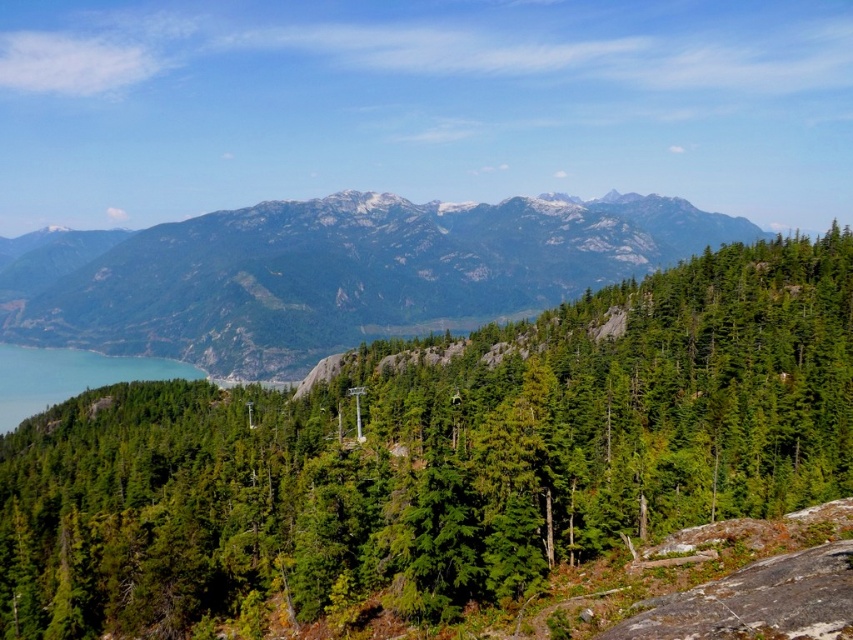
Measure the distance between green matte tree at center and camera.

green matte tree at center is 175.66 feet away from camera.

Is green matte tree at center above green rocky mountain at center?

Incorrect, green matte tree at center is not positioned above green rocky mountain at center.

Which is in front, point (682, 339) or point (173, 269)?

Positioned in front is point (682, 339).

You are a GUI agent. You are given a task and a screenshot of the screen. Output one action in this format:
    pyautogui.click(x=<x>, y=<y>)
    Task: Click on the green matte tree at center
    This screenshot has width=853, height=640.
    Given the screenshot: What is the action you would take?
    pyautogui.click(x=439, y=456)